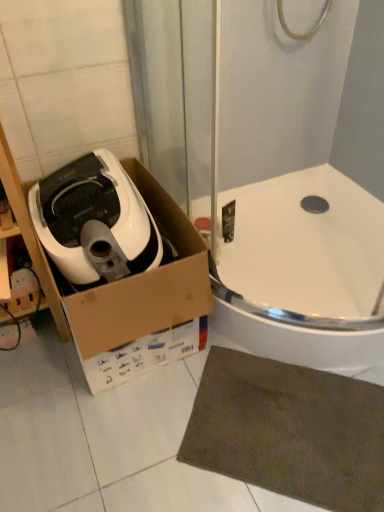
The width and height of the screenshot is (384, 512). What are the coordinates of `vacant space underneath brown textured bath mat at lower right (from a real-world perspective)` in the screenshot? It's located at (289, 434).